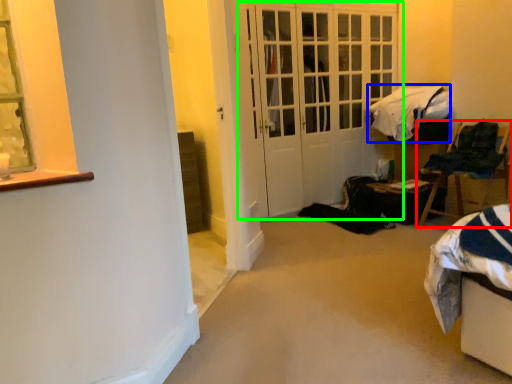
Question: Which is nearer to the chair (highlighted by a red box)? blanket (highlighted by a blue box) or door (highlighted by a green box).

Choices:
 (A) blanket
 (B) door

Answer: (A)